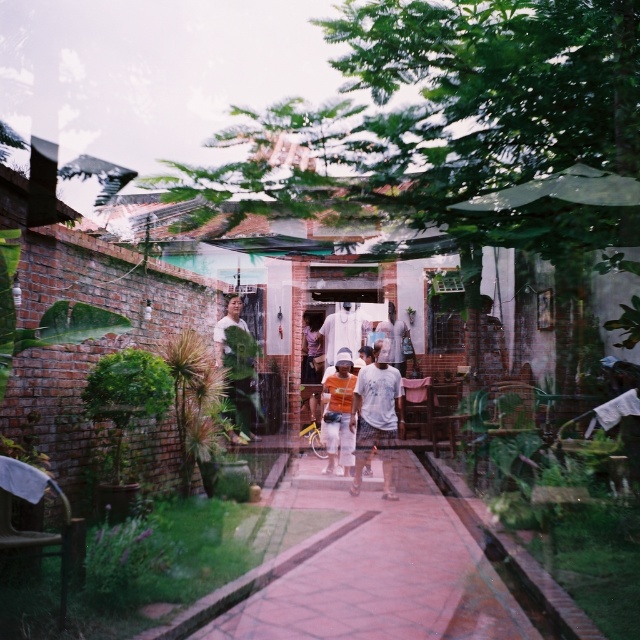
You are organizing a clothing display in a store and have two shirts in front of you. You need to place the matte green shirt at center and the orange cotton shirt at center on a mannequin. Which shirt should you put on the mannequin first if you want the bigger one to be more visible?

The matte green shirt at center is bigger than the orange cotton shirt at center, so you should put the matte green shirt at center on the mannequin first to ensure it is more visible.

You are standing in the serene outdoor scene described. You need to locate the matte green shirt at center. According to the coordinates provided, where exactly should you look to find it?

The matte green shirt at center is located at the coordinates point [236,362].

You are standing at the entrance of the house and see both the brick paved path at center and the white fabric shirt at center. Which object is positioned to the left from your perspective?

The brick paved path at center is to the left of the white fabric shirt at center.